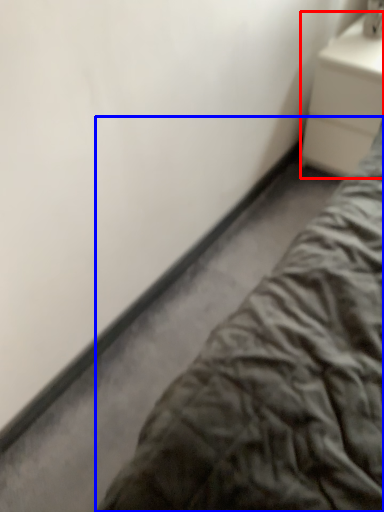
Question: Which point is closer to the camera, nightstand (highlighted by a red box) or bed (highlighted by a blue box)?

Choices:
 (A) nightstand
 (B) bed

Answer: (B)